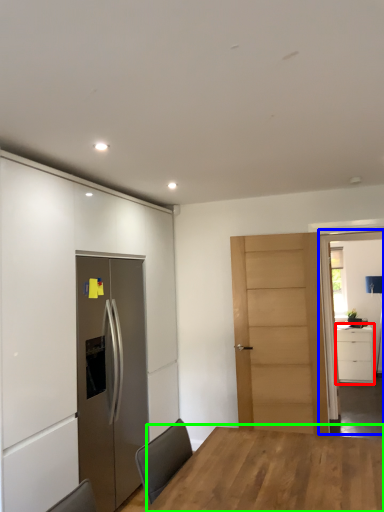
Question: Considering the real-world distances, which object is farthest from cabinetry (highlighted by a red box)? glass door (highlighted by a blue box) or table (highlighted by a green box)?

Choices:
 (A) glass door
 (B) table

Answer: (B)